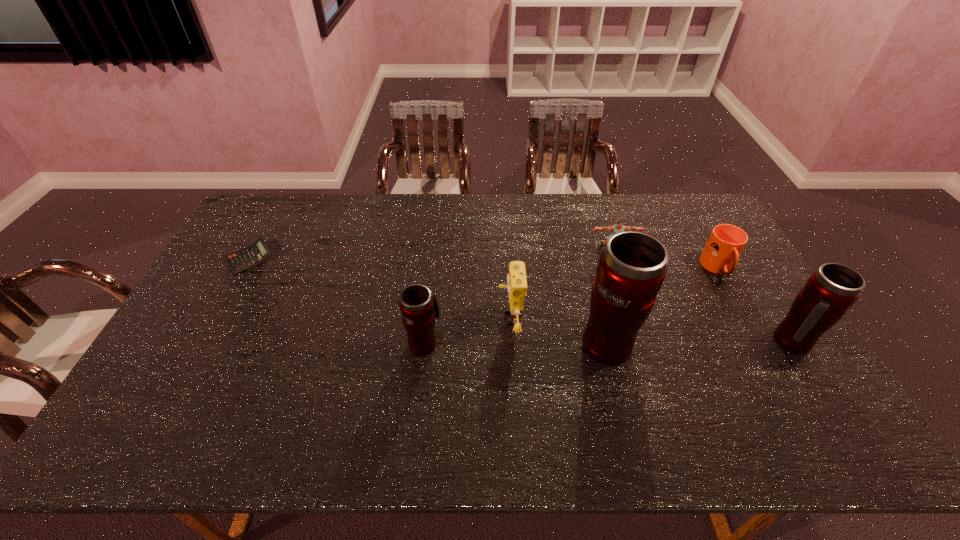
Identify the location of sponge. The height and width of the screenshot is (540, 960). (516, 278).

The width and height of the screenshot is (960, 540). Find the location of `vacant space located 0.340m on the side with the handle of the leftmost thermos bottle`. vacant space located 0.340m on the side with the handle of the leftmost thermos bottle is located at coordinates (435, 249).

Locate an element on the screen. Image resolution: width=960 pixels, height=540 pixels. vacant area situated on the side with the handle of the leftmost thermos bottle is located at coordinates (427, 315).

At what (x,y) coordinates should I click in order to perform the action: click on vacant space located 0.140m on the side with the handle of the leftmost thermos bottle. Please return your answer as a coordinate pair (x, y). This screenshot has width=960, height=540. Looking at the image, I should click on point(430,293).

The width and height of the screenshot is (960, 540). I want to click on free location located 0.100m on the side with the handle of the second thermos bottle from left to right, so click(x=596, y=294).

The height and width of the screenshot is (540, 960). Find the location of `vacant area situated 0.050m on the side with the handle of the second thermos bottle from left to right`. vacant area situated 0.050m on the side with the handle of the second thermos bottle from left to right is located at coordinates (599, 306).

What are the coordinates of `free space located 0.370m on the side with the handle of the second thermos bottle from left to right` in the screenshot? It's located at (582, 237).

Identify the location of vacant space situated 0.110m on the side with the handle of the second tallest thermos bottle. The width and height of the screenshot is (960, 540). (826, 397).

You are a GUI agent. You are given a task and a screenshot of the screen. Output one action in this format:
    pyautogui.click(x=<x>, y=<y>)
    Task: Click on the free space located on the handle side of the mug
    The width and height of the screenshot is (960, 540).
    Given the screenshot: What is the action you would take?
    pyautogui.click(x=769, y=360)

Locate an element on the screen. vacant position located 0.150m on the back of the shortest object is located at coordinates (274, 217).